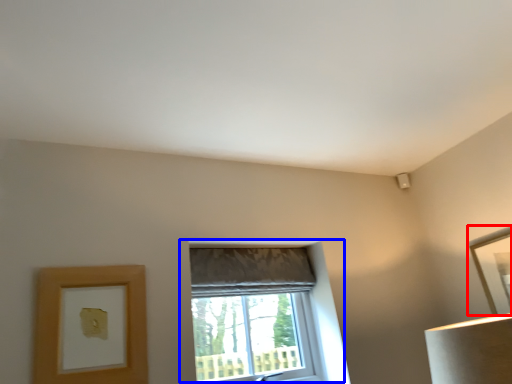
Question: Which object appears farthest to the camera in this image, picture frame (highlighted by a red box) or window (highlighted by a blue box)?

Choices:
 (A) picture frame
 (B) window

Answer: (A)